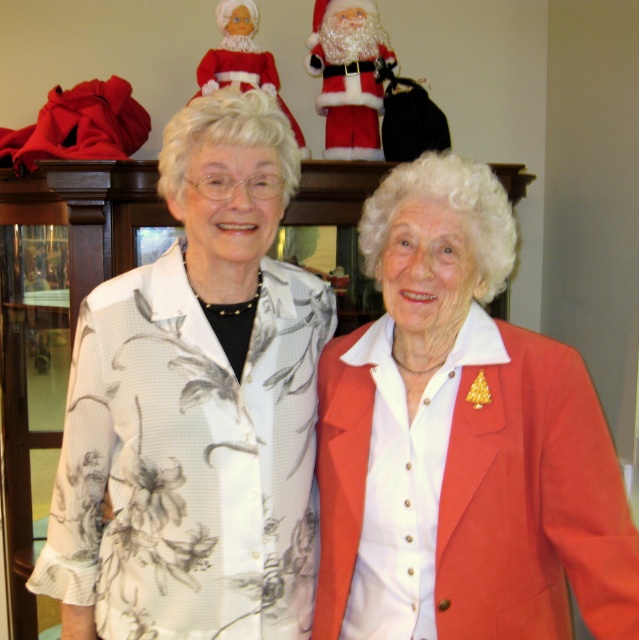
You are an interior designer analyzing the image. You need to place a small plant in the exact center of the image. Will the plant overlap with the matte red blazer at center?

The matte red blazer at center is located at point (x=461, y=440), which is not the exact center of the image. Therefore, placing the plant at the exact center will not overlap with the matte red blazer at center.

You are a delivery person who needs to place a small package between the matte red blazer at center and the fuzzy santa at upper center. Can you fit it there?

The distance between the matte red blazer at center and the fuzzy santa at upper center is 1.21 meters, so yes, the small package can fit in that space.